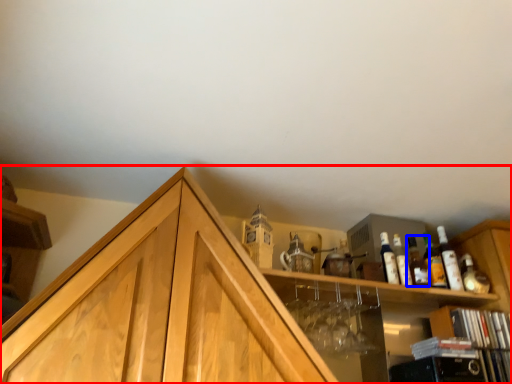
Question: Which object is further to the camera taking this photo, cabinetry (highlighted by a red box) or bottle (highlighted by a blue box)?

Choices:
 (A) cabinetry
 (B) bottle

Answer: (B)